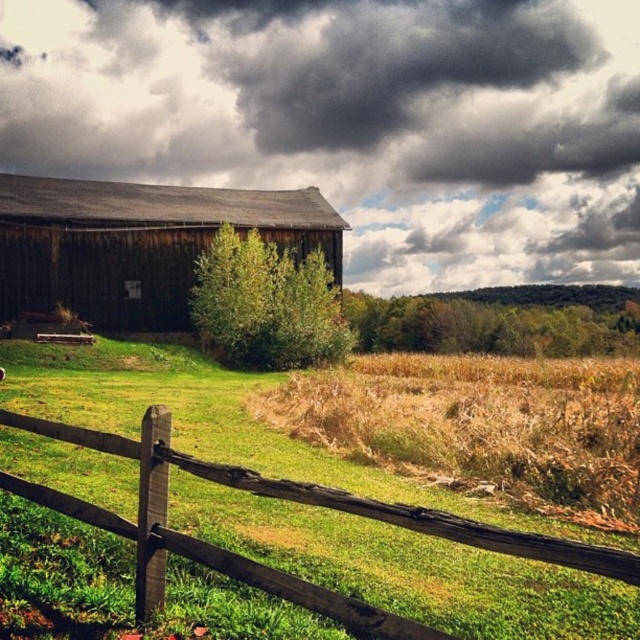
Between weathered wood barn at left and dark brown wooden barn at center, which one is positioned higher?

Positioned higher is weathered wood barn at left.

Who is positioned more to the right, weathered wood barn at left or dark brown wooden barn at center?

weathered wood barn at left is more to the right.

Is point (220, 148) positioned after point (134, 205)?

Yes.

At what (x,y) coordinates should I click in order to perform the action: click on weathered wood barn at left. Please return your answer as a coordinate pair (x, y). The width and height of the screenshot is (640, 640). Looking at the image, I should click on (355, 120).

Which is more to the right, dark brown wooden barn at center or brown wooden fence at lower left?

Positioned to the right is brown wooden fence at lower left.

Which is below, dark brown wooden barn at center or brown wooden fence at lower left?

Positioned lower is brown wooden fence at lower left.

You are a GUI agent. You are given a task and a screenshot of the screen. Output one action in this format:
    pyautogui.click(x=<x>, y=<y>)
    Task: Click on the dark brown wooden barn at center
    The height and width of the screenshot is (640, 640).
    Given the screenshot: What is the action you would take?
    pyautogui.click(x=136, y=243)

Does weathered wood barn at left have a greater height compared to brown wooden fence at lower left?

Yes.

You are a GUI agent. You are given a task and a screenshot of the screen. Output one action in this format:
    pyautogui.click(x=<x>, y=<y>)
    Task: Click on the weathered wood barn at left
    
    Given the screenshot: What is the action you would take?
    click(x=355, y=120)

Where is `weathered wood barn at left`? weathered wood barn at left is located at coordinates (355, 120).